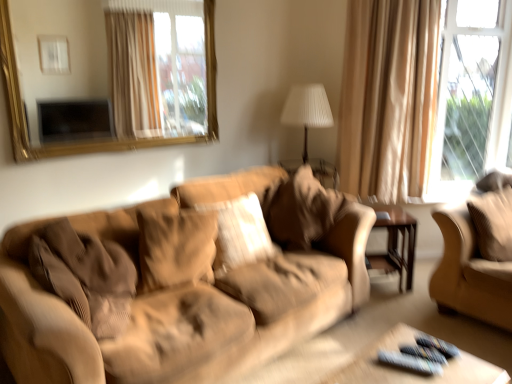
How much space does suede-like beige pillow at center, acting as the third pillow starting from the left, occupy vertically?

17.14 inches.

What do you see at coordinates (240, 233) in the screenshot?
I see `suede-like beige pillow at center, placed as the second pillow when sorted from left to right` at bounding box center [240, 233].

This screenshot has width=512, height=384. I want to click on wooden remote control tray at lower right, so (x=412, y=372).

What do you see at coordinates (395, 242) in the screenshot?
I see `brown wood side table at center right` at bounding box center [395, 242].

Measure the distance between suede-like beige couch at right and camera.

A distance of 2.36 meters exists between suede-like beige couch at right and camera.

This screenshot has height=384, width=512. What do you see at coordinates (469, 272) in the screenshot?
I see `suede-like beige couch at right` at bounding box center [469, 272].

At what (x,y) coordinates should I click in order to perform the action: click on suede-like beige pillow at center, the second pillow viewed from the right. Please return your answer as a coordinate pair (x, y). Image resolution: width=512 pixels, height=384 pixels. Looking at the image, I should click on (302, 210).

Which is behind, clear glass window at upper right or suede-like beige pillow at center, which appears as the 3th pillow when viewed from the right?

clear glass window at upper right is further from the camera.

Considering the sizes of clear glass window at upper right and suede-like beige pillow at center, which appears as the 3th pillow when viewed from the right, in the image, is clear glass window at upper right taller or shorter than suede-like beige pillow at center, which appears as the 3th pillow when viewed from the right,?

Clearly, clear glass window at upper right is taller compared to suede-like beige pillow at center, which appears as the 3th pillow when viewed from the right.

From the image's perspective, which one is positioned lower, clear glass window at upper right or suede-like beige pillow at center, placed as the second pillow when sorted from left to right?

suede-like beige pillow at center, placed as the second pillow when sorted from left to right, from the image's perspective.

Is clear glass window at upper right not inside suede-like beige pillow at center, placed as the second pillow when sorted from left to right?

Absolutely, clear glass window at upper right is external to suede-like beige pillow at center, placed as the second pillow when sorted from left to right.

Is white pleated fabric at center spatially inside corduroy pillow at right, arranged as the first pillow when viewed from the right, or outside of it?

white pleated fabric at center is not inside corduroy pillow at right, arranged as the first pillow when viewed from the right, it's outside.

This screenshot has width=512, height=384. In order to click on table lamp above the corduroy pillow at right, arranged as the first pillow when viewed from the right (from the image's perspective) in this screenshot , I will do `click(307, 110)`.

From a real-world perspective, is white pleated fabric at center physically located above or below corduroy pillow at right, the 4th pillow viewed from the left?

white pleated fabric at center is above corduroy pillow at right, the 4th pillow viewed from the left.

Consider the image. Is brown wood side table at center right completely or partially inside wooden remote control tray at lower right?

No, brown wood side table at center right is located outside of wooden remote control tray at lower right.

What's the angular difference between wooden remote control tray at lower right and brown wood side table at center right's facing directions?

There is a 36-degree angle between the facing directions of wooden remote control tray at lower right and brown wood side table at center right.

Considering the positions of point (354, 381) and point (388, 257), is point (354, 381) closer or farther from the camera than point (388, 257)?

Point (354, 381).

Is brown wood side table at center right at the back of wooden remote control tray at lower right?

No.

Can we say suede-like beige pillow at center, which appears as the 4th pillow when viewed from the right, lies outside suede-like beige couch at right?

Yes, suede-like beige pillow at center, which appears as the 4th pillow when viewed from the right, is located beyond the bounds of suede-like beige couch at right.

In terms of width, does suede-like beige pillow at center, which appears as the 4th pillow when viewed from the right, look wider or thinner when compared to suede-like beige couch at right?

suede-like beige pillow at center, which appears as the 4th pillow when viewed from the right, is thinner than suede-like beige couch at right.

Does point (208, 257) lie in front of point (439, 304)?

Yes, it is.

Consider the image. Is there a large distance between suede-like beige pillow at center, which appears as the 4th pillow when viewed from the right, and suede-like beige couch at right?

Yes, suede-like beige pillow at center, which appears as the 4th pillow when viewed from the right, and suede-like beige couch at right are quite far apart.

Is corduroy pillow at right, the 4th pillow viewed from the left, next to clear glass window at upper right?

There is a gap between corduroy pillow at right, the 4th pillow viewed from the left, and clear glass window at upper right.

Does corduroy pillow at right, the 4th pillow viewed from the left, have a greater width compared to clear glass window at upper right?

Correct, the width of corduroy pillow at right, the 4th pillow viewed from the left, exceeds that of clear glass window at upper right.

Is corduroy pillow at right, arranged as the first pillow when viewed from the right, bigger or smaller than clear glass window at upper right?

Clearly, corduroy pillow at right, arranged as the first pillow when viewed from the right, is smaller in size than clear glass window at upper right.

How many degrees apart are the facing directions of wooden remote control tray at lower right and clear glass window at upper right?

The angular difference between wooden remote control tray at lower right and clear glass window at upper right is 31.8 degrees.

Between wooden remote control tray at lower right and clear glass window at upper right, which one has more height?

Standing taller between the two is clear glass window at upper right.

From a real-world perspective, is wooden remote control tray at lower right positioned above or below clear glass window at upper right?

From a real-world perspective, wooden remote control tray at lower right is physically below clear glass window at upper right.

Is wooden remote control tray at lower right touching clear glass window at upper right?

No, wooden remote control tray at lower right is not with clear glass window at upper right.

Which is farther from the camera, (208, 225) or (313, 189)?

The point (313, 189) is farther from the camera.

From a real-world perspective, is suede-like beige pillow at center, the first pillow from the left, located higher than suede-like beige pillow at center, the second pillow viewed from the right?

No.

From the image's perspective, which one is positioned lower, suede-like beige pillow at center, which appears as the 4th pillow when viewed from the right, or suede-like beige pillow at center, acting as the third pillow starting from the left?

suede-like beige pillow at center, which appears as the 4th pillow when viewed from the right, appears lower in the image.

Which of these two, suede-like beige pillow at center, the first pillow from the left, or suede-like beige pillow at center, acting as the third pillow starting from the left, stands shorter?

suede-like beige pillow at center, the first pillow from the left.

Where is `window on the right side of suede-like beige pillow at center, which appears as the 3th pillow when viewed from the right`? This screenshot has height=384, width=512. window on the right side of suede-like beige pillow at center, which appears as the 3th pillow when viewed from the right is located at coordinates (471, 95).

Which pillow is the 2nd one when counting from the front of the white pleated fabric at center? Please provide its 2D coordinates.

[(493, 223)]

In the scene shown: Which object lies nearer to the anchor point clear glass window at upper right, suede-like beige pillow at center, which appears as the 4th pillow when viewed from the right, or white pleated fabric at center?

white pleated fabric at center is positioned closer to the anchor clear glass window at upper right.

Based on their spatial positions, is corduroy pillow at right, the 4th pillow viewed from the left, or gold-framed mirror at upper left further from brown wood side table at center right?

gold-framed mirror at upper left lies further to brown wood side table at center right than the other object.

Based on their spatial positions, is suede-like beige pillow at center, the second pillow viewed from the right, or clear glass window at upper right closer to white pleated fabric at center?

The object closer to white pleated fabric at center is suede-like beige pillow at center, the second pillow viewed from the right.

Looking at the image, which one is located further to beige fabric curtain at upper right, suede-like beige couch at right or wooden remote control tray at lower right?

wooden remote control tray at lower right.

Which object lies further to the anchor point suede-like beige pillow at center, placed as the second pillow when sorted from left to right, beige fabric curtain at upper right or corduroy pillow at right, arranged as the first pillow when viewed from the right?

corduroy pillow at right, arranged as the first pillow when viewed from the right, lies further to suede-like beige pillow at center, placed as the second pillow when sorted from left to right, than the other object.

When comparing their distances from clear glass window at upper right, does suede-like beige pillow at center, which appears as the 3th pillow when viewed from the right, or suede-like beige couch at right seem closer?

suede-like beige couch at right is positioned closer to the anchor clear glass window at upper right.

Based on their spatial positions, is suede-like beige pillow at center, acting as the third pillow starting from the left, or wooden remote control tray at lower right closer to gold-framed mirror at upper left?

Based on the image, suede-like beige pillow at center, acting as the third pillow starting from the left, appears to be nearer to gold-framed mirror at upper left.

Consider the image. From the image, which object appears to be nearer to corduroy pillow at right, arranged as the first pillow when viewed from the right, suede-like beige couch at right or white pleated fabric at center?

Among the two, suede-like beige couch at right is located nearer to corduroy pillow at right, arranged as the first pillow when viewed from the right.

Locate an element on the screen. The width and height of the screenshot is (512, 384). side table located between suede-like beige pillow at center, acting as the third pillow starting from the left, and corduroy pillow at right, arranged as the first pillow when viewed from the right, in the left-right direction is located at coordinates (395, 242).

Locate an element on the screen. The width and height of the screenshot is (512, 384). curtain between clear glass window at upper right and suede-like beige couch at right in the vertical direction is located at coordinates (388, 97).

Identify the location of table lamp between suede-like beige pillow at center, the first pillow from the left, and corduroy pillow at right, the 4th pillow viewed from the left. (307, 110).

Identify the location of side table between suede-like beige pillow at center, which appears as the 3th pillow when viewed from the right, and corduroy pillow at right, the 4th pillow viewed from the left, in the horizontal direction. (395, 242).